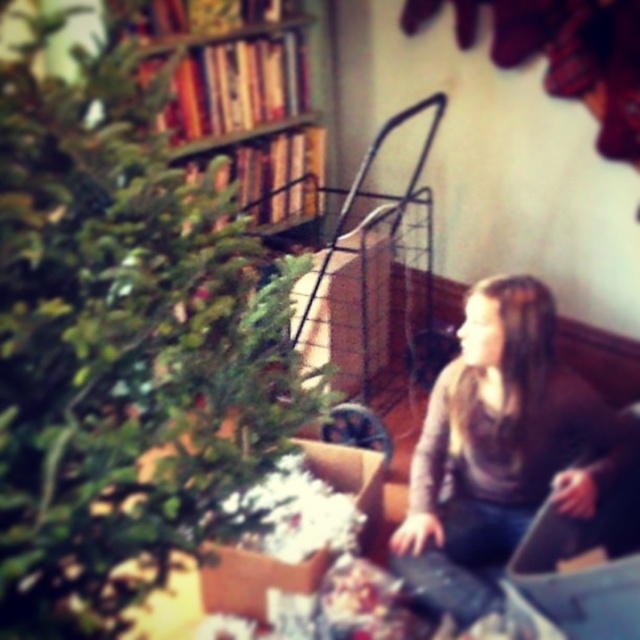
Based on the photo, you are organizing a holiday party and need to place a new decorative item in the room. The item is the size of the matte brown sweater at lower right. Can you fit it next to the wooden bookshelf at upper center without moving anything else?

Yes, the matte brown sweater at lower right occupies less space than the wooden bookshelf at upper center, so there should be enough space to place the decorative item next to the wooden bookshelf at upper center without moving anything else.

You are a delivery person who needs to place a new package in the room. The package is the size of the matte brown sweater at lower right. Can the green matte christmas tree at left fit in the space where the package will be placed?

The green matte christmas tree at left has a lesser width compared to the matte brown sweater at lower right, so it can fit in the space allocated for the package since it is narrower.